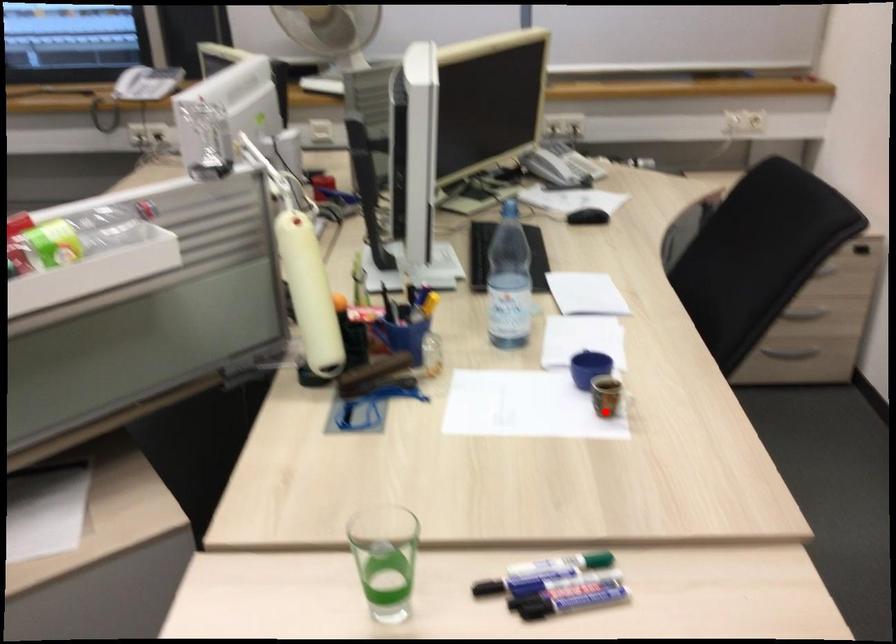
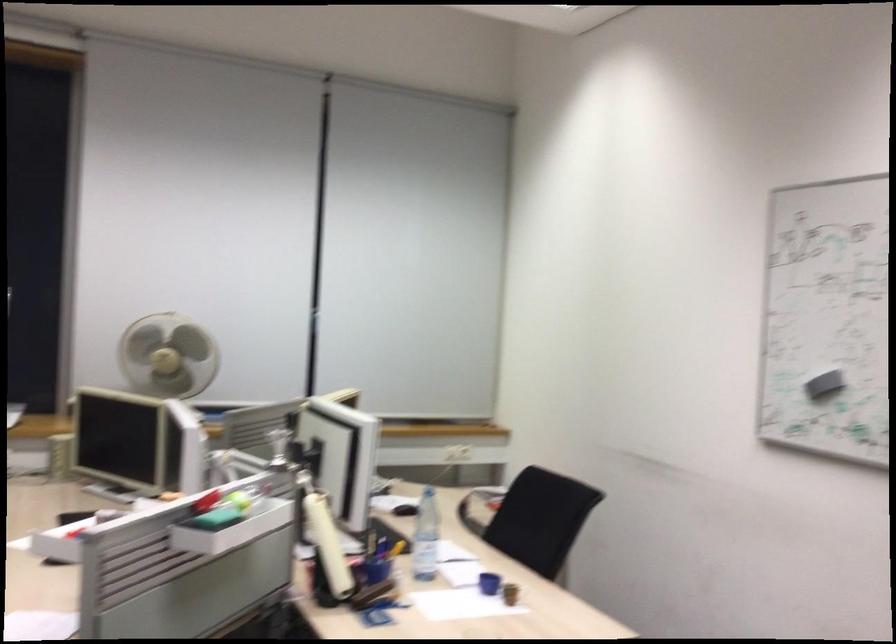
Where in the second image is the point corresponding to the highlighted location from the first image?

(510, 592)